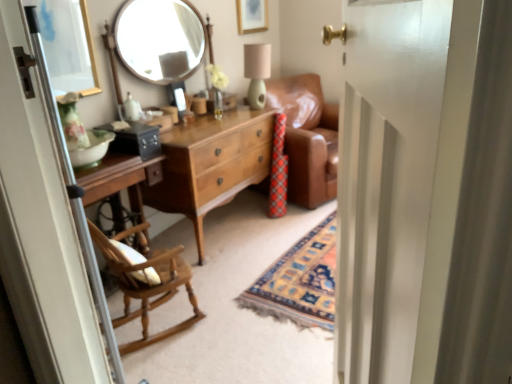
Question: Is light brown wood dresser at center to the left of gold-framed picture at upper center, the first picture frame positioned from the top, from the viewer's perspective?

Choices:
 (A) yes
 (B) no

Answer: (A)

Question: From a real-world perspective, is light brown wood dresser at center on top of gold-framed picture at upper center, which is counted as the 2th picture frame, starting from the front?

Choices:
 (A) yes
 (B) no

Answer: (B)

Question: Is light brown wood dresser at center not near gold-framed picture at upper center, arranged as the second picture frame when ordered from the bottom?

Choices:
 (A) no
 (B) yes

Answer: (B)

Question: Considering the relative sizes of light brown wood dresser at center and gold-framed picture at upper center, the first picture frame positioned from the top, in the image provided, is light brown wood dresser at center wider than gold-framed picture at upper center, the first picture frame positioned from the top,?

Choices:
 (A) no
 (B) yes

Answer: (B)

Question: Could you tell me if light brown wood dresser at center is turned towards gold-framed picture at upper center, arranged as the second picture frame when ordered from the bottom?

Choices:
 (A) yes
 (B) no

Answer: (B)

Question: Considering the positions of white glossy door at center, which appears as the first screen door when viewed from the right, and gold-framed picture at upper center, arranged as the second picture frame when ordered from the bottom, in the image, is white glossy door at center, which appears as the first screen door when viewed from the right, bigger or smaller than gold-framed picture at upper center, arranged as the second picture frame when ordered from the bottom,?

Choices:
 (A) big
 (B) small

Answer: (A)

Question: From the image's perspective, relative to gold-framed picture at upper center, which is counted as the 1th picture frame, starting from the back, is white glossy door at center, which appears as the first screen door when viewed from the right, above or below?

Choices:
 (A) above
 (B) below

Answer: (B)

Question: Considering the relative positions of white glossy door at center, which appears as the first screen door when viewed from the right, and gold-framed picture at upper center, arranged as the second picture frame when ordered from the bottom, in the image provided, is white glossy door at center, which appears as the first screen door when viewed from the right, to the left or to the right of gold-framed picture at upper center, arranged as the second picture frame when ordered from the bottom,?

Choices:
 (A) left
 (B) right

Answer: (B)

Question: In terms of height, does white glossy door at center, which appears as the first screen door when viewed from the right, look taller or shorter compared to gold-framed picture at upper center, which is counted as the 2th picture frame, starting from the front?

Choices:
 (A) short
 (B) tall

Answer: (B)

Question: Is matte white vase at center taller or shorter than gold-framed picture at upper center, arranged as the second picture frame when ordered from the bottom?

Choices:
 (A) short
 (B) tall

Answer: (A)

Question: Is matte white vase at center to the left or to the right of gold-framed picture at upper center, arranged as the second picture frame when ordered from the bottom, in the image?

Choices:
 (A) left
 (B) right

Answer: (A)

Question: From a real-world perspective, is matte white vase at center physically located above or below gold-framed picture at upper center, which ranks as the 2th picture frame in left-to-right order?

Choices:
 (A) above
 (B) below

Answer: (B)

Question: Is matte white vase at center wider or thinner than gold-framed picture at upper center, which is counted as the 1th picture frame, starting from the back?

Choices:
 (A) thin
 (B) wide

Answer: (B)

Question: Looking at the image, does gold-framed mirror at upper left, acting as the 2th picture frame starting from the top, seem bigger or smaller compared to matte green lampshade at upper center?

Choices:
 (A) big
 (B) small

Answer: (B)

Question: Considering the relative positions of gold-framed mirror at upper left, which is counted as the 1th picture frame, starting from the front, and matte green lampshade at upper center in the image provided, is gold-framed mirror at upper left, which is counted as the 1th picture frame, starting from the front, to the left or to the right of matte green lampshade at upper center?

Choices:
 (A) left
 (B) right

Answer: (A)